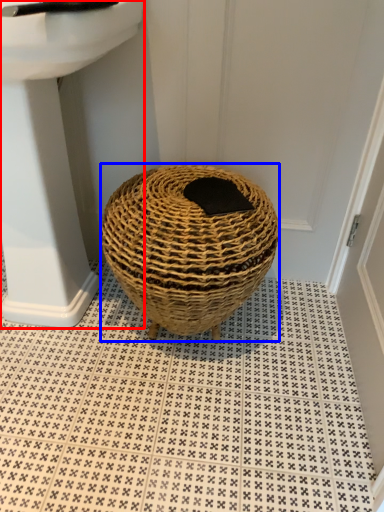
Question: Which point is closer to the camera, sink (highlighted by a red box) or basket (highlighted by a blue box)?

Choices:
 (A) sink
 (B) basket

Answer: (A)